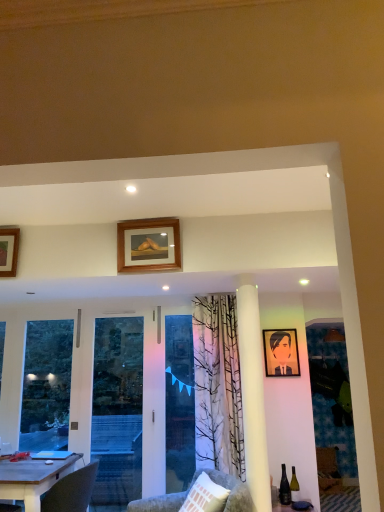
Question: From a real-world perspective, is matte glass wine bottle at lower right on top of wooden portrait at center, acting as the 3th picture frame starting from the left?

Choices:
 (A) no
 (B) yes

Answer: (A)

Question: Is matte glass wine bottle at lower right facing away from wooden portrait at center, acting as the 1th picture frame starting from the back?

Choices:
 (A) no
 (B) yes

Answer: (A)

Question: Is matte glass wine bottle at lower right positioned beyond the bounds of wooden portrait at center, positioned as the 3th picture frame in top-to-bottom order?

Choices:
 (A) yes
 (B) no

Answer: (A)

Question: Can wooden portrait at center, acting as the 3th picture frame starting from the left, be found inside matte glass wine bottle at lower right?

Choices:
 (A) yes
 (B) no

Answer: (B)

Question: Is matte glass wine bottle at lower right next to wooden portrait at center, placed as the first picture frame when sorted from right to left, and touching it?

Choices:
 (A) yes
 (B) no

Answer: (B)

Question: Is wooden picture frame at upper left, the 2th picture frame when ordered from front to back, spatially inside matte glass wine bottle at lower right, or outside of it?

Choices:
 (A) outside
 (B) inside

Answer: (A)

Question: Relative to matte glass wine bottle at lower right, is wooden picture frame at upper left, the second picture frame viewed from the top, in front or behind?

Choices:
 (A) behind
 (B) front

Answer: (B)

Question: From the image's perspective, is wooden picture frame at upper left, the 2th picture frame when ordered from front to back, positioned above or below matte glass wine bottle at lower right?

Choices:
 (A) above
 (B) below

Answer: (A)

Question: In terms of height, does wooden picture frame at upper left, the 3th picture frame viewed from the right, look taller or shorter compared to matte glass wine bottle at lower right?

Choices:
 (A) short
 (B) tall

Answer: (B)

Question: Is transparent glass screen door at left wider or thinner than wooden table at lower left?

Choices:
 (A) thin
 (B) wide

Answer: (A)

Question: Considering the positions of transparent glass screen door at left and wooden table at lower left in the image, is transparent glass screen door at left taller or shorter than wooden table at lower left?

Choices:
 (A) tall
 (B) short

Answer: (A)

Question: From the image's perspective, relative to wooden table at lower left, is transparent glass screen door at left above or below?

Choices:
 (A) below
 (B) above

Answer: (B)

Question: From a real-world perspective, is transparent glass screen door at left positioned above or below wooden table at lower left?

Choices:
 (A) below
 (B) above

Answer: (B)

Question: Considering the relative positions of matte glass wine bottle at lower right and blue fabric at center in the image provided, is matte glass wine bottle at lower right to the left or to the right of blue fabric at center?

Choices:
 (A) left
 (B) right

Answer: (B)

Question: Considering the positions of matte glass wine bottle at lower right and blue fabric at center in the image, is matte glass wine bottle at lower right wider or thinner than blue fabric at center?

Choices:
 (A) wide
 (B) thin

Answer: (A)